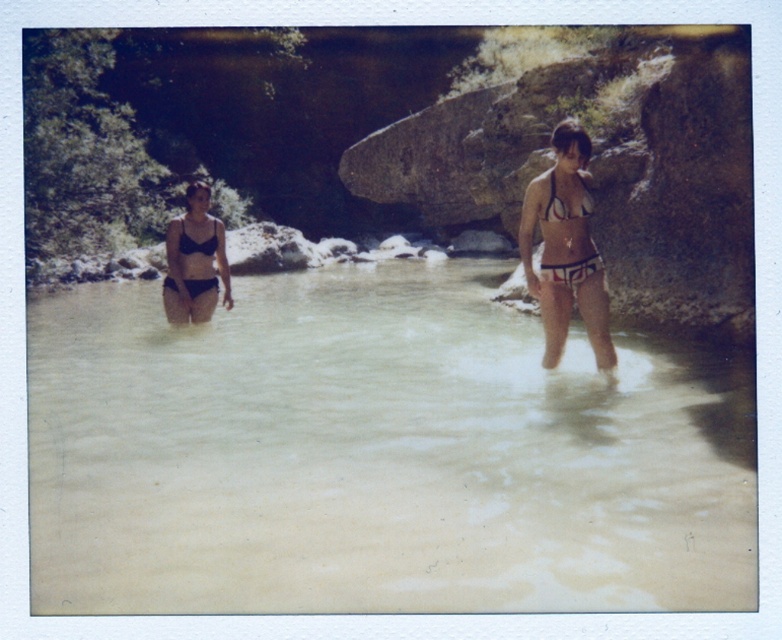
Question: Which of these objects is positioned closest to the matte black bikini at center?

Choices:
 (A) white matte bikini at right
 (B) clear water at center
 (C) matte black bikini at left
 (D) black matte bikini top at center

Answer: (D)

Question: Does matte black bikini at left have a greater width compared to white matte bikini at right?

Choices:
 (A) yes
 (B) no

Answer: (A)

Question: Which point is farther to the camera?

Choices:
 (A) (149, 387)
 (B) (579, 192)
 (C) (565, 205)
 (D) (560, 198)

Answer: (A)

Question: Is matte black bikini top at upper right bigger than black matte bikini top at center?

Choices:
 (A) yes
 (B) no

Answer: (A)

Question: Which is nearer to the white bikini at center?

Choices:
 (A) black matte bikini top at center
 (B) matte black bikini top at upper right
 (C) matte black bikini at left
 (D) clear water at center

Answer: (B)

Question: From the image, what is the correct spatial relationship of matte black bikini at left in relation to black matte bikini top at center?

Choices:
 (A) right
 (B) left

Answer: (B)